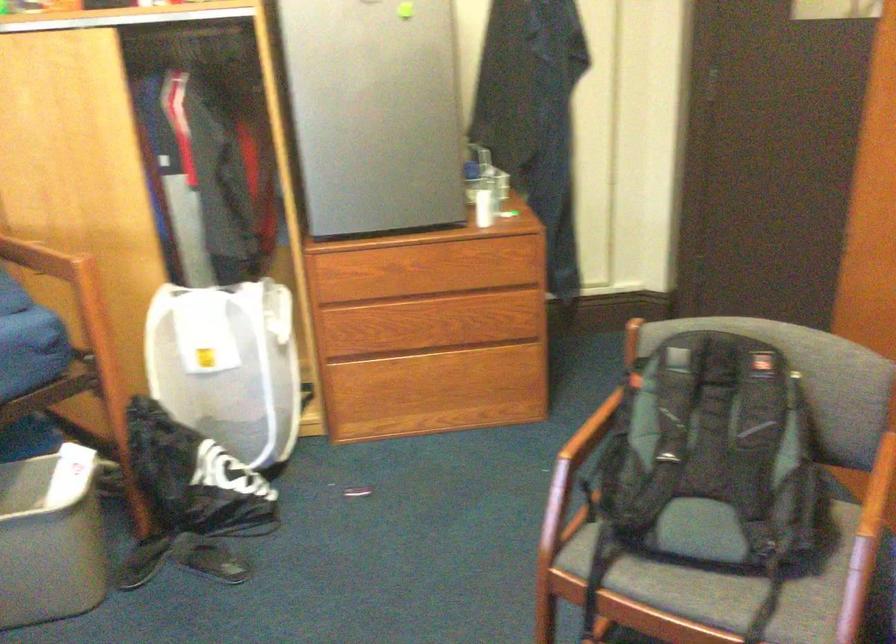
You are a GUI agent. You are given a task and a screenshot of the screen. Output one action in this format:
    pyautogui.click(x=<x>, y=<y>)
    Task: Click on the grey plastic bin
    
    Given the screenshot: What is the action you would take?
    pyautogui.click(x=49, y=538)